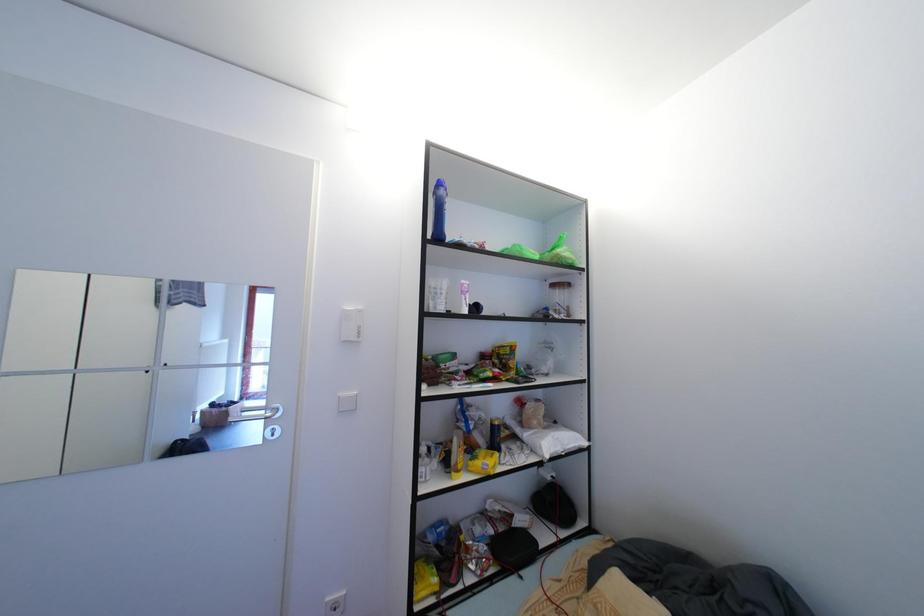
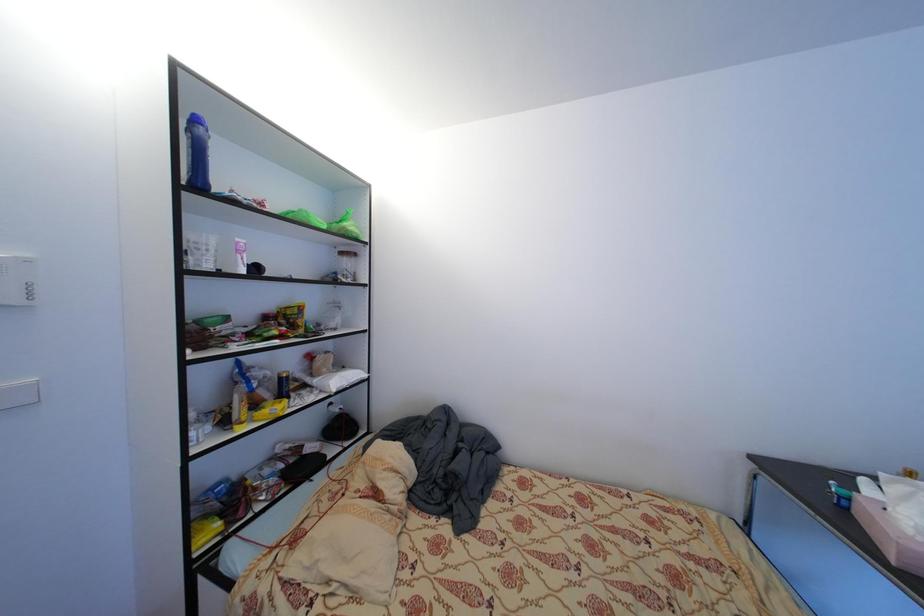
Question: The camera is either moving clockwise (left) or counter-clockwise (right) around the object. The first image is from the beginning of the video and the second image is from the end. Is the camera moving left or right when shooting the video?

Choices:
 (A) Left
 (B) Right

Answer: (A)